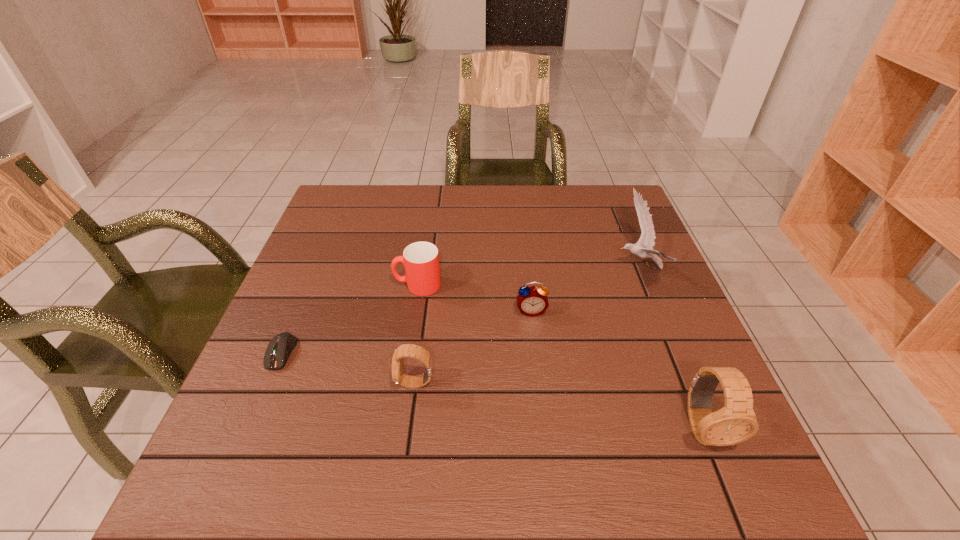
In order to click on vacant space in between the shortest object and the fourth object from left to right in this screenshot , I will do `click(406, 332)`.

Where is `empty space between the alarm clock and the shortest object`? empty space between the alarm clock and the shortest object is located at coordinates (406, 332).

The width and height of the screenshot is (960, 540). I want to click on empty space that is in between the farther watch and the gull, so click(x=527, y=325).

This screenshot has width=960, height=540. Identify the location of free spot between the cup and the gull. (528, 276).

Find the location of a particular element. This screenshot has width=960, height=540. free space between the leftmost object and the left watch is located at coordinates (348, 368).

At what (x,y) coordinates should I click in order to perform the action: click on unoccupied area between the nearest object and the left watch. Please return your answer as a coordinate pair (x, y). Image resolution: width=960 pixels, height=540 pixels. Looking at the image, I should click on (559, 405).

This screenshot has width=960, height=540. Identify the location of free spot between the taller watch and the leftmost object. (492, 390).

This screenshot has height=540, width=960. Find the location of `vacant area between the nearest object and the farther watch`. vacant area between the nearest object and the farther watch is located at coordinates (559, 405).

Find the location of a particular element. Image resolution: width=960 pixels, height=540 pixels. empty space between the gull and the fourth object from left to right is located at coordinates (585, 289).

Where is `free spot between the computer equipment and the gull`? free spot between the computer equipment and the gull is located at coordinates (460, 310).